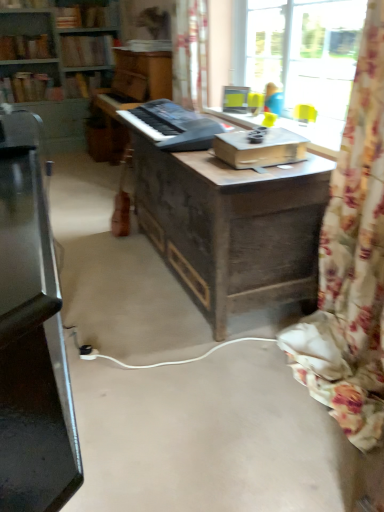
The width and height of the screenshot is (384, 512). I want to click on free space in front of dark wood table at center, so click(180, 379).